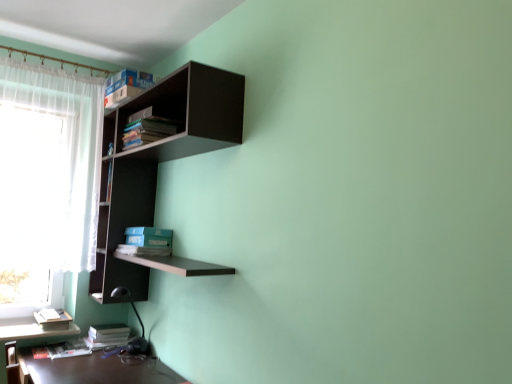
Question: Is hardcover book at lower left, the first book positioned from the bottom, located within blue matte bookshelf at center, the second book viewed from the top?

Choices:
 (A) yes
 (B) no

Answer: (B)

Question: Can you confirm if blue matte bookshelf at center, the second book viewed from the top, is smaller than hardcover book at lower left, the first book positioned from the bottom?

Choices:
 (A) yes
 (B) no

Answer: (B)

Question: Does blue matte bookshelf at center, the second book viewed from the top, have a larger size compared to hardcover book at lower left, the first book positioned from the bottom?

Choices:
 (A) yes
 (B) no

Answer: (A)

Question: Considering the relative positions of blue matte bookshelf at center, the second book viewed from the top, and hardcover book at lower left, the first book positioned from the bottom, in the image provided, is blue matte bookshelf at center, the second book viewed from the top, in front of hardcover book at lower left, the first book positioned from the bottom,?

Choices:
 (A) no
 (B) yes

Answer: (A)

Question: Is there a large distance between blue matte bookshelf at center, the second book viewed from the top, and hardcover book at lower left, the first book positioned from the bottom?

Choices:
 (A) no
 (B) yes

Answer: (A)

Question: From the image's perspective, is hardcover book at lower left, the 2th book in the bottom-to-top sequence, positioned above or below dark wood shelf at upper left?

Choices:
 (A) above
 (B) below

Answer: (B)

Question: From a real-world perspective, is hardcover book at lower left, acting as the fourth book starting from the top, positioned above or below dark wood shelf at upper left?

Choices:
 (A) above
 (B) below

Answer: (B)

Question: Choose the correct answer: Is hardcover book at lower left, the 2th book in the bottom-to-top sequence, inside dark wood shelf at upper left or outside it?

Choices:
 (A) inside
 (B) outside

Answer: (B)

Question: In terms of height, does hardcover book at lower left, the 2th book in the bottom-to-top sequence, look taller or shorter compared to dark wood shelf at upper left?

Choices:
 (A) tall
 (B) short

Answer: (B)

Question: From their relative heights in the image, would you say hardcover book at lower left, the first book positioned from the bottom, is taller or shorter than white sheer curtain at left?

Choices:
 (A) tall
 (B) short

Answer: (B)

Question: Would you say hardcover book at lower left, the first book positioned from the bottom, is inside or outside white sheer curtain at left?

Choices:
 (A) inside
 (B) outside

Answer: (B)

Question: Is point (83, 352) positioned closer to the camera than point (20, 241)?

Choices:
 (A) closer
 (B) farther

Answer: (A)

Question: Based on their positions, is hardcover book at lower left, the fifth book viewed from the top, located to the left or right of white sheer curtain at left?

Choices:
 (A) left
 (B) right

Answer: (B)

Question: Looking at their shapes, would you say blue matte bookshelf at center, the second book viewed from the top, is wider or thinner than white sheer curtain at left?

Choices:
 (A) thin
 (B) wide

Answer: (B)

Question: From the image's perspective, relative to white sheer curtain at left, is blue matte bookshelf at center, the 4th book positioned from the bottom, above or below?

Choices:
 (A) below
 (B) above

Answer: (A)